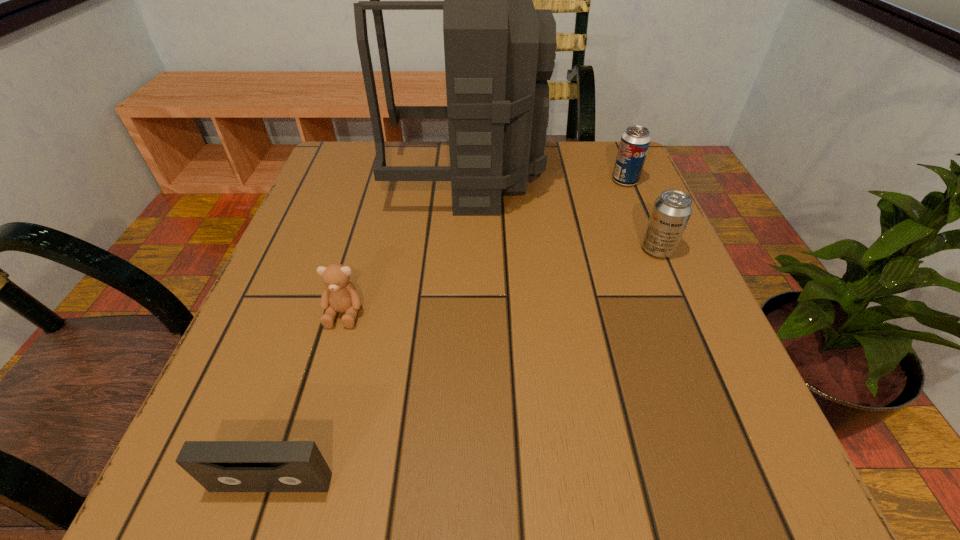
Locate an element on the screen. vacant region between the tallest object and the third nearest object is located at coordinates (562, 213).

Where is `blank region between the nearer beer can and the second nearest object`? blank region between the nearer beer can and the second nearest object is located at coordinates (501, 281).

This screenshot has height=540, width=960. I want to click on object that ranks as the fourth closest to the nearer beer can, so click(x=219, y=466).

Point out which object is positioned as the second nearest to the farther beer can. Please provide its 2D coordinates. Your answer should be formatted as a tuple, i.e. [(x, y)], where the tuple contains the x and y coordinates of a point satisfying the conditions above.

[(671, 212)]

This screenshot has height=540, width=960. I want to click on vacant space that satisfies the following two spatial constraints: 1. on the front compartment of the tallest object; 2. on the front-facing side of the teddy bear, so click(460, 313).

Where is `vacant space that satisfies the following two spatial constraints: 1. on the front compartment of the tallest object; 2. on the back side of the farther beer can`? Image resolution: width=960 pixels, height=540 pixels. vacant space that satisfies the following two spatial constraints: 1. on the front compartment of the tallest object; 2. on the back side of the farther beer can is located at coordinates (466, 181).

Where is `vacant space that satisfies the following two spatial constraints: 1. on the front compartment of the backpack; 2. on the right side of the nearer beer can`? The image size is (960, 540). vacant space that satisfies the following two spatial constraints: 1. on the front compartment of the backpack; 2. on the right side of the nearer beer can is located at coordinates 463,249.

This screenshot has width=960, height=540. Find the location of `vacant space that satisfies the following two spatial constraints: 1. on the front compartment of the backpack; 2. on the front-facing side of the second nearest object`. vacant space that satisfies the following two spatial constraints: 1. on the front compartment of the backpack; 2. on the front-facing side of the second nearest object is located at coordinates (460, 313).